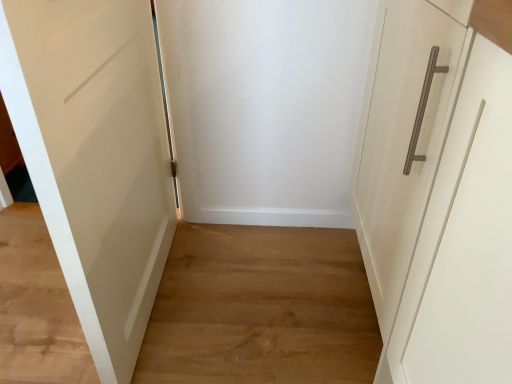
This screenshot has height=384, width=512. Describe the element at coordinates (95, 157) in the screenshot. I see `white matte door at left` at that location.

Measure the distance between white matte door at left and camera.

They are 21.32 inches apart.

Where is `white matte door at left`? The image size is (512, 384). white matte door at left is located at coordinates (95, 157).

What do you see at coordinates (261, 308) in the screenshot? Image resolution: width=512 pixels, height=384 pixels. I see `wooden floor at center` at bounding box center [261, 308].

This screenshot has width=512, height=384. Identify the location of wooden floor at center. (261, 308).

In the scene shown: Measure the distance between wooden floor at center and camera.

wooden floor at center and camera are 1.09 meters apart from each other.

At what (x,y) coordinates should I click in order to perform the action: click on white matte door at left. Please return your answer as a coordinate pair (x, y). The height and width of the screenshot is (384, 512). Looking at the image, I should click on (95, 157).

In the image, is wooden floor at center on the left side or the right side of white matte door at left?

wooden floor at center is positioned on white matte door at left's left side.

Is wooden floor at center behind white matte door at left?

Yes.

Does point (282, 282) lie behind point (33, 104)?

Yes.

From the image's perspective, is wooden floor at center positioned above or below white matte door at left?

wooden floor at center is below white matte door at left.

From a real-world perspective, who is located lower, wooden floor at center or white matte door at left?

From a 3D spatial view, wooden floor at center is below.

Which of these two, wooden floor at center or white matte door at left, is thinner?

With smaller width is white matte door at left.

Considering the sizes of wooden floor at center and white matte door at left in the image, is wooden floor at center taller or shorter than white matte door at left?

Clearly, wooden floor at center is shorter compared to white matte door at left.

Considering the sizes of objects wooden floor at center and white matte door at left in the image provided, who is smaller, wooden floor at center or white matte door at left?

wooden floor at center.

Is white matte door at left located within wooden floor at center?

No, wooden floor at center does not contain white matte door at left.

Is there a large distance between wooden floor at center and white matte door at left?

No.

Is wooden floor at center aimed at white matte door at left?

No.

Consider the image. How different are the orientations of wooden floor at center and white matte door at left in degrees?

They differ by 92.3 degrees in their facing directions.

Measure the distance from wooden floor at center to white matte door at left.

The distance of wooden floor at center from white matte door at left is 17.00 inches.

The width and height of the screenshot is (512, 384). In order to click on path lying behind the white matte door at left in this screenshot , I will do `click(261, 308)`.

Which object is positioned more to the left, white matte door at left or wooden floor at center?

wooden floor at center.

Considering the relative positions of white matte door at left and wooden floor at center in the image provided, is white matte door at left in front of wooden floor at center?

Yes, white matte door at left is closer to the viewer.

Does point (167, 244) appear closer or farther from the camera than point (364, 315)?

Point (167, 244) is farther from the camera than point (364, 315).

From the image's perspective, which one is positioned lower, white matte door at left or wooden floor at center?

From the image's view, wooden floor at center is below.

From a real-world perspective, which is physically above, white matte door at left or wooden floor at center?

In real-world perspective, white matte door at left is above.

Considering the relative sizes of white matte door at left and wooden floor at center in the image provided, is white matte door at left wider than wooden floor at center?

A: No.

Between white matte door at left and wooden floor at center, which one has less height?

With less height is wooden floor at center.

Who is bigger, white matte door at left or wooden floor at center?

white matte door at left is bigger.

Is wooden floor at center surrounded by white matte door at left?

No.

Is white matte door at left not near wooden floor at center?

white matte door at left is near wooden floor at center, not far away.

Is wooden floor at center at the back of white matte door at left?

white matte door at left is not turned away from wooden floor at center.

What's the angular difference between white matte door at left and wooden floor at center's facing directions?

The angle between the facing direction of white matte door at left and the facing direction of wooden floor at center is 92.3 degrees.

In the image, there is a white matte door at left. What are the coordinates of `path below it (from the image's perspective)` in the screenshot? It's located at (261, 308).

Where is `door in front of the wooden floor at center`? The width and height of the screenshot is (512, 384). door in front of the wooden floor at center is located at coordinates (95, 157).

The image size is (512, 384). What are the coordinates of `door on the right of wooden floor at center` in the screenshot? It's located at [95, 157].